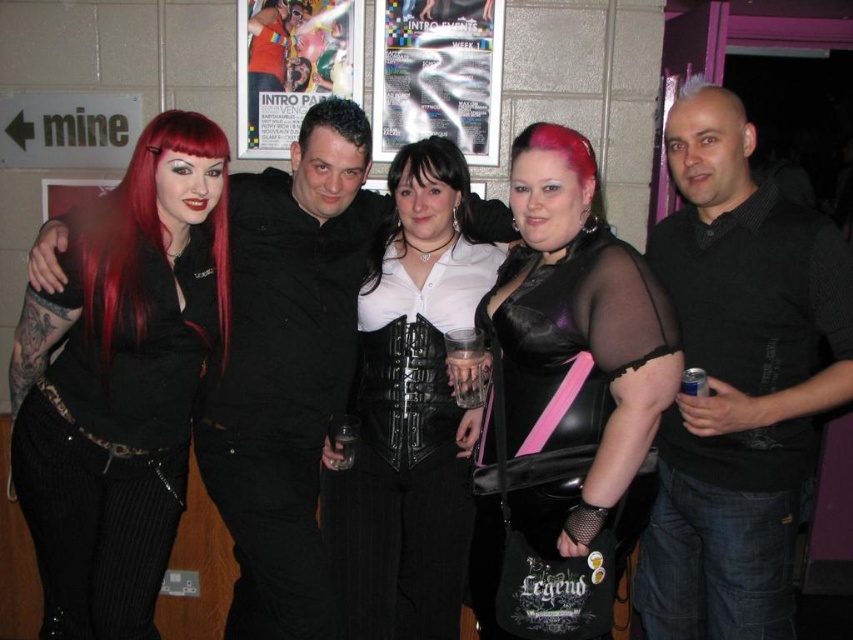
Question: Considering the real-world distances, which object is closest to the metallic silver poster at upper center?

Choices:
 (A) black leather corset at center
 (B) matte black top at left
 (C) black textured shirt at center

Answer: (A)

Question: Considering the real-world distances, which object is farthest from the metallic silver poster at upper center?

Choices:
 (A) black textured shirt at center
 (B) black matte shirt at center

Answer: (A)

Question: Can you confirm if black leather dress at center is thinner than black matte shirt at center?

Choices:
 (A) no
 (B) yes

Answer: (B)

Question: Which object appears farthest from the camera in this image?

Choices:
 (A) black leather dress at center
 (B) matte black top at left

Answer: (B)

Question: Is black textured shirt at center thinner than matte black top at left?

Choices:
 (A) no
 (B) yes

Answer: (B)

Question: Can you confirm if black textured shirt at center is positioned below metallic silver poster at upper center?

Choices:
 (A) yes
 (B) no

Answer: (A)